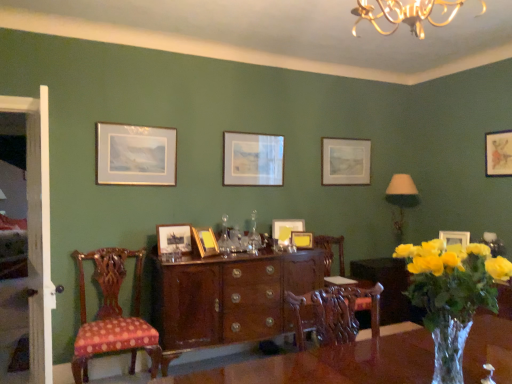
Find the location of `free location above yellow matte picture frame at center, the fifth picture frame viewed from the right (from a real-world perspective)`. free location above yellow matte picture frame at center, the fifth picture frame viewed from the right (from a real-world perspective) is located at coordinates (283, 221).